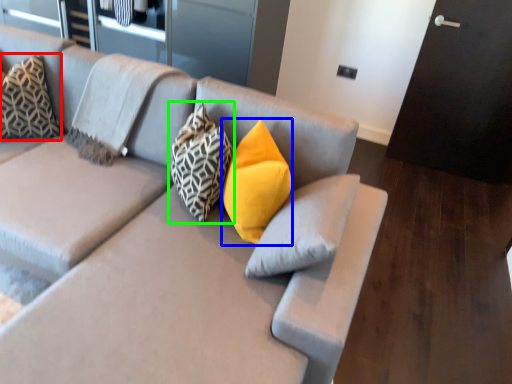
Question: Estimate the real-world distances between objects in this image. Which object is farther from pillow (highlighted by a red box), pillow (highlighted by a blue box) or pillow (highlighted by a green box)?

Choices:
 (A) pillow
 (B) pillow

Answer: (A)